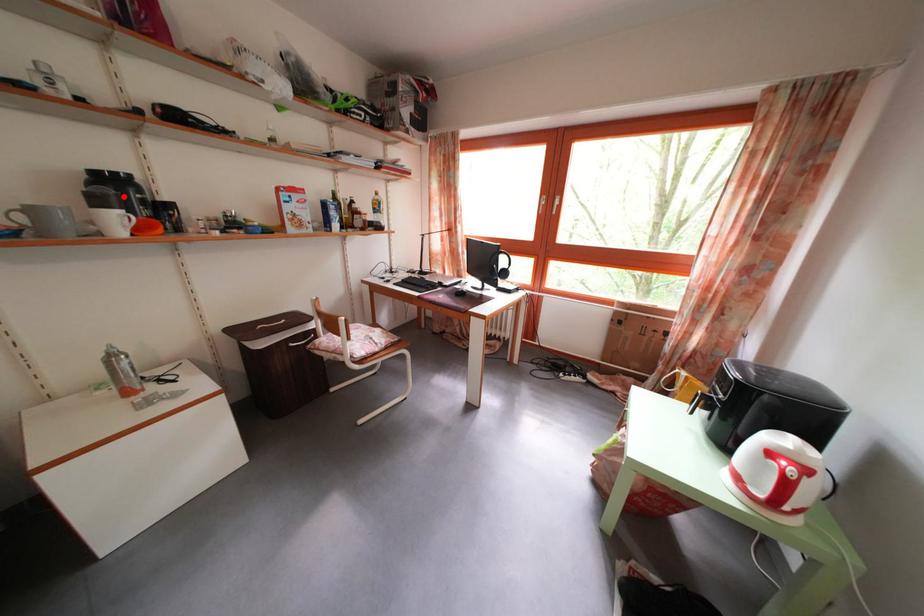
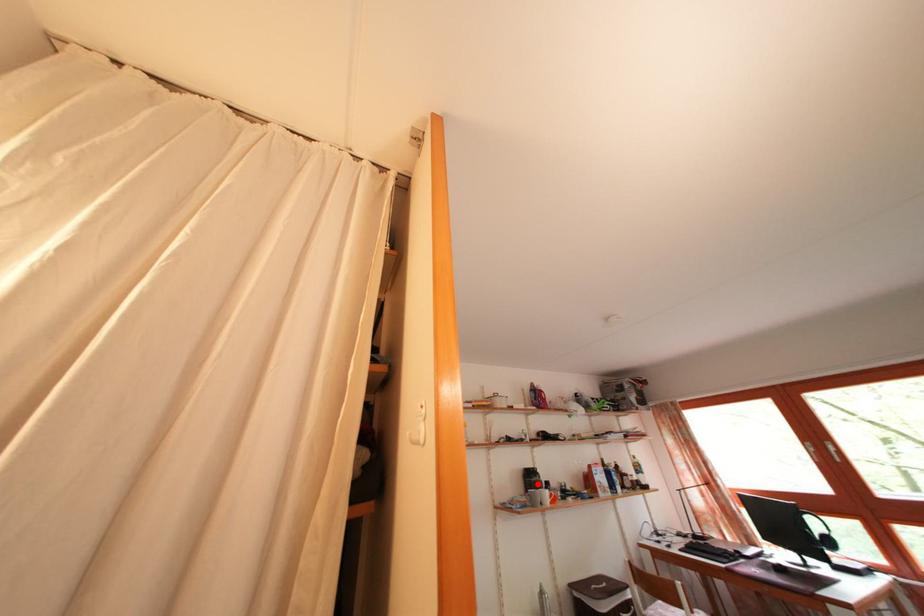
I am providing you with two images of the same scene from different viewpoints. A red point is marked on the first image and another point is marked on the second image. Is the red point in image1 aligned with the point shown in image2?

Yes